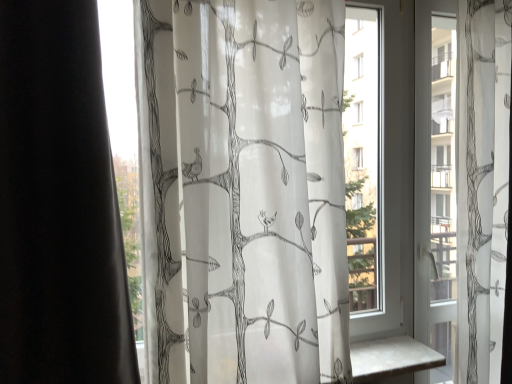
Question: From a real-world perspective, does translucent white fabric at center stand above transparent glass window at right?

Choices:
 (A) yes
 (B) no

Answer: (A)

Question: Considering the relative sizes of translucent white fabric at center and transparent glass window at right in the image provided, is translucent white fabric at center bigger than transparent glass window at right?

Choices:
 (A) no
 (B) yes

Answer: (B)

Question: Does translucent white fabric at center come behind transparent glass window at right?

Choices:
 (A) no
 (B) yes

Answer: (A)

Question: Is translucent white fabric at center positioned far away from transparent glass window at right?

Choices:
 (A) yes
 (B) no

Answer: (B)

Question: Is translucent white fabric at center oriented away from transparent glass window at right?

Choices:
 (A) yes
 (B) no

Answer: (B)

Question: Does translucent white fabric at center come in front of transparent glass window at right?

Choices:
 (A) yes
 (B) no

Answer: (A)

Question: Is transparent glass window at right bigger than translucent white fabric at center?

Choices:
 (A) yes
 (B) no

Answer: (B)

Question: Is transparent glass window at right positioned behind translucent white fabric at center?

Choices:
 (A) yes
 (B) no

Answer: (A)

Question: Are transparent glass window at right and translucent white fabric at center located far from each other?

Choices:
 (A) yes
 (B) no

Answer: (B)

Question: Would you say transparent glass window at right is outside translucent white fabric at center?

Choices:
 (A) yes
 (B) no

Answer: (A)

Question: Is transparent glass window at right to the right of translucent white fabric at center from the viewer's perspective?

Choices:
 (A) yes
 (B) no

Answer: (A)

Question: Is transparent glass window at right wider than translucent white fabric at center?

Choices:
 (A) no
 (B) yes

Answer: (A)

Question: Considering the positions of transparent glass window at right and translucent white fabric at center in the image, is transparent glass window at right wider or thinner than translucent white fabric at center?

Choices:
 (A) thin
 (B) wide

Answer: (A)